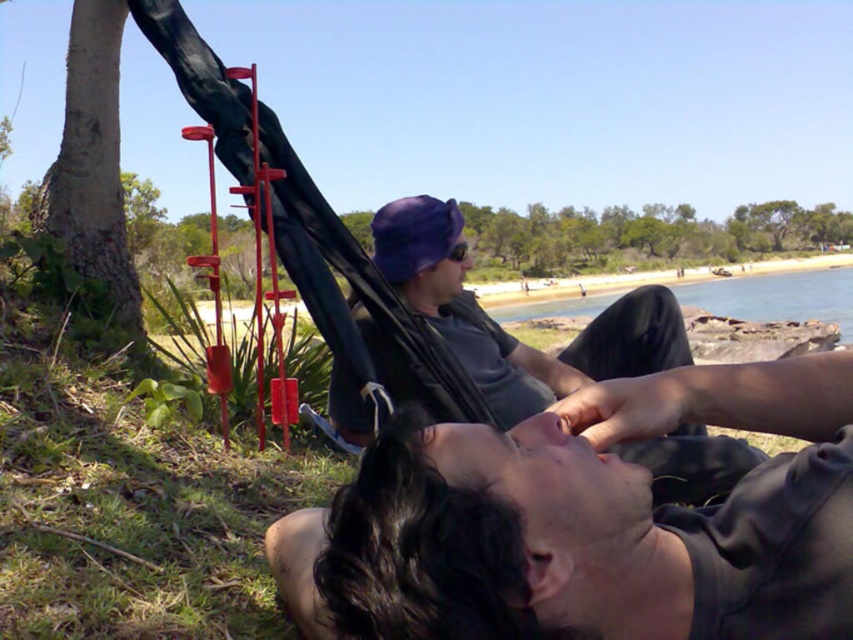
Question: Is the position of smooth brown tree trunk at left more distant than that of clear blue water at beach right?

Choices:
 (A) no
 (B) yes

Answer: (A)

Question: Based on their relative distances, which object is nearer to the clear blue water at beach right?

Choices:
 (A) matte gray shirt at center
 (B) smooth brown tree trunk at left
 (C) dark gray fabric hammock at center

Answer: (A)

Question: Which of the following is the closest to the observer?

Choices:
 (A) (480, 332)
 (B) (668, 388)

Answer: (B)

Question: Can you confirm if smooth brown tree trunk at left is wider than clear blue water at beach right?

Choices:
 (A) yes
 (B) no

Answer: (B)

Question: Which of the following is the closest to the observer?

Choices:
 (A) (776, 531)
 (B) (848, 310)
 (C) (434, 307)

Answer: (A)

Question: Is dark gray fabric hammock at center to the left of smooth brown tree trunk at left from the viewer's perspective?

Choices:
 (A) yes
 (B) no

Answer: (B)